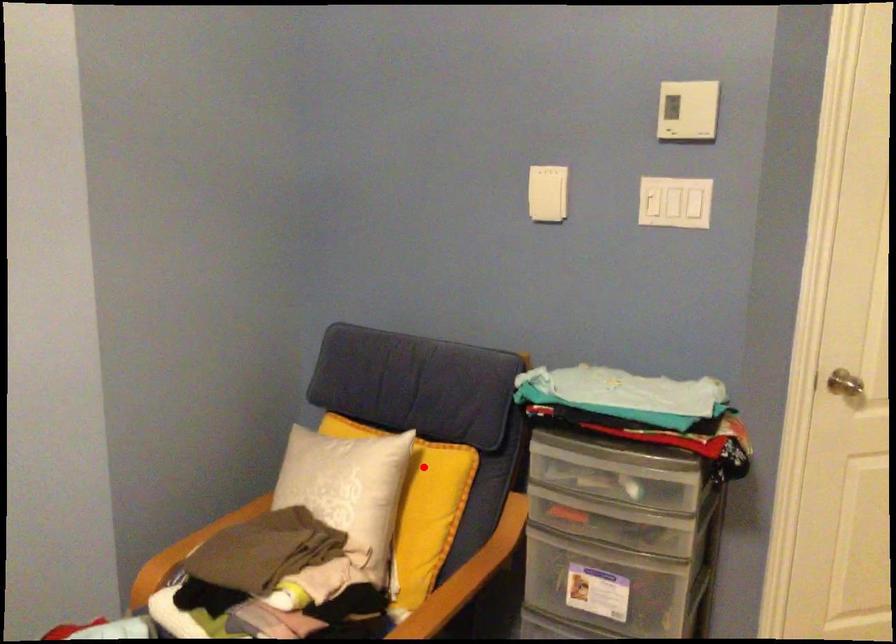
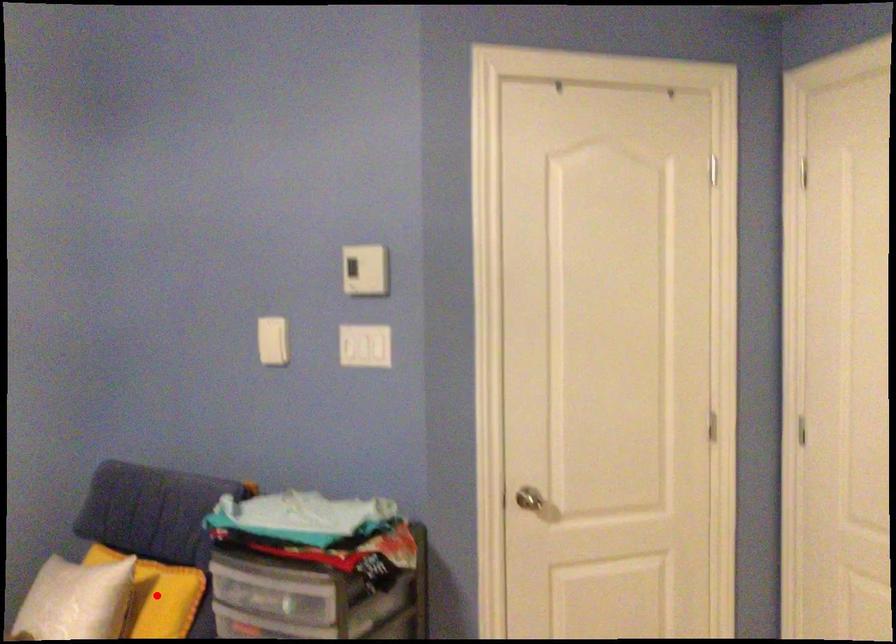
I am providing you with two images of the same scene from different viewpoints. A red point is marked on the first image and another point is marked on the second image. Are the points marked in image1 and image2 representing the same 3D position?

Yes